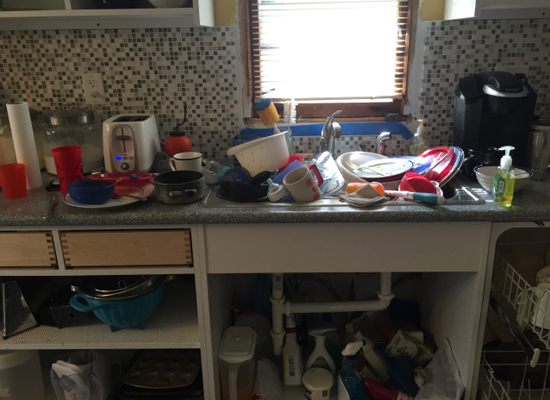
Identify the location of toaster lever. (122, 136).